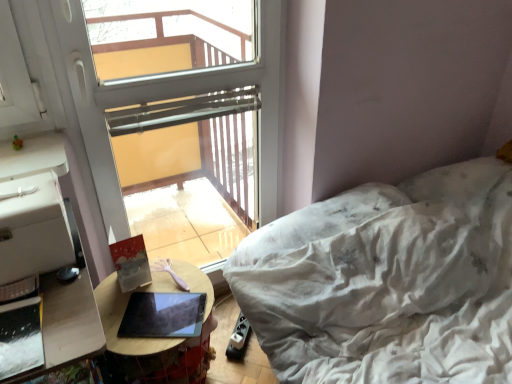
Question: Can you confirm if transparent glass window at upper center is thinner than wooden table at lower left?

Choices:
 (A) yes
 (B) no

Answer: (A)

Question: Can you confirm if transparent glass window at upper center is wider than wooden table at lower left?

Choices:
 (A) no
 (B) yes

Answer: (A)

Question: Is transparent glass window at upper center directly adjacent to wooden table at lower left?

Choices:
 (A) no
 (B) yes

Answer: (A)

Question: Does transparent glass window at upper center come behind wooden table at lower left?

Choices:
 (A) yes
 (B) no

Answer: (B)

Question: Is the depth of transparent glass window at upper center less than that of wooden table at lower left?

Choices:
 (A) no
 (B) yes

Answer: (B)

Question: From a real-world perspective, does transparent glass window at upper center sit lower than wooden table at lower left?

Choices:
 (A) no
 (B) yes

Answer: (A)

Question: Is transparent glass window at upper center oriented away from matte black tablet at center?

Choices:
 (A) no
 (B) yes

Answer: (A)

Question: Is transparent glass window at upper center shorter than matte black tablet at center?

Choices:
 (A) no
 (B) yes

Answer: (A)

Question: Considering the relative positions of transparent glass window at upper center and matte black tablet at center in the image provided, is transparent glass window at upper center to the left of matte black tablet at center from the viewer's perspective?

Choices:
 (A) yes
 (B) no

Answer: (B)

Question: From a real-world perspective, is transparent glass window at upper center positioned under matte black tablet at center based on gravity?

Choices:
 (A) no
 (B) yes

Answer: (A)

Question: Considering the relative sizes of transparent glass window at upper center and matte black tablet at center in the image provided, is transparent glass window at upper center bigger than matte black tablet at center?

Choices:
 (A) no
 (B) yes

Answer: (B)

Question: From a real-world perspective, does transparent glass window at upper center stand above matte black tablet at center?

Choices:
 (A) yes
 (B) no

Answer: (A)

Question: Is matte black tablet at center not near wooden table at lower left?

Choices:
 (A) no
 (B) yes

Answer: (A)